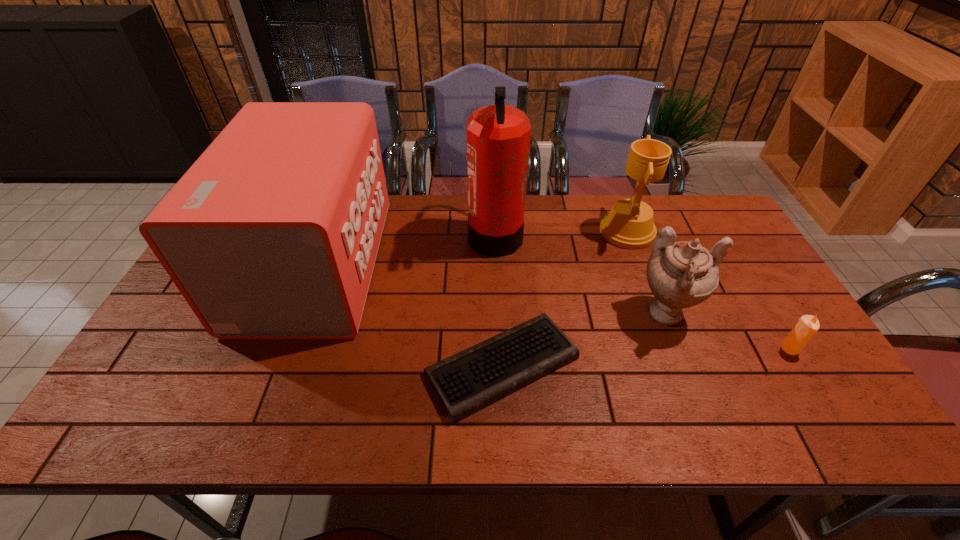
Find the location of `fire extinguisher`. fire extinguisher is located at coordinates (498, 136).

Locate an element on the screen. This screenshot has height=540, width=960. box is located at coordinates (273, 232).

Identify the location of the leftmost object. This screenshot has width=960, height=540. (273, 232).

What are the coordinates of `award` in the screenshot? It's located at (629, 224).

Where is `urn`? urn is located at coordinates (682, 274).

At what (x,y) coordinates should I click in order to perform the action: click on candle. Please return your answer as a coordinate pair (x, y). This screenshot has width=960, height=540. Looking at the image, I should click on (808, 325).

Find the location of a particular element. the second shortest object is located at coordinates (808, 325).

Locate an element on the screen. The width and height of the screenshot is (960, 540). the shortest object is located at coordinates (466, 382).

This screenshot has height=540, width=960. I want to click on free region located 0.130m on the front side of the fire extinguisher, so click(428, 235).

Where is `free space located on the front side of the fire extinguisher`? The height and width of the screenshot is (540, 960). free space located on the front side of the fire extinguisher is located at coordinates (453, 235).